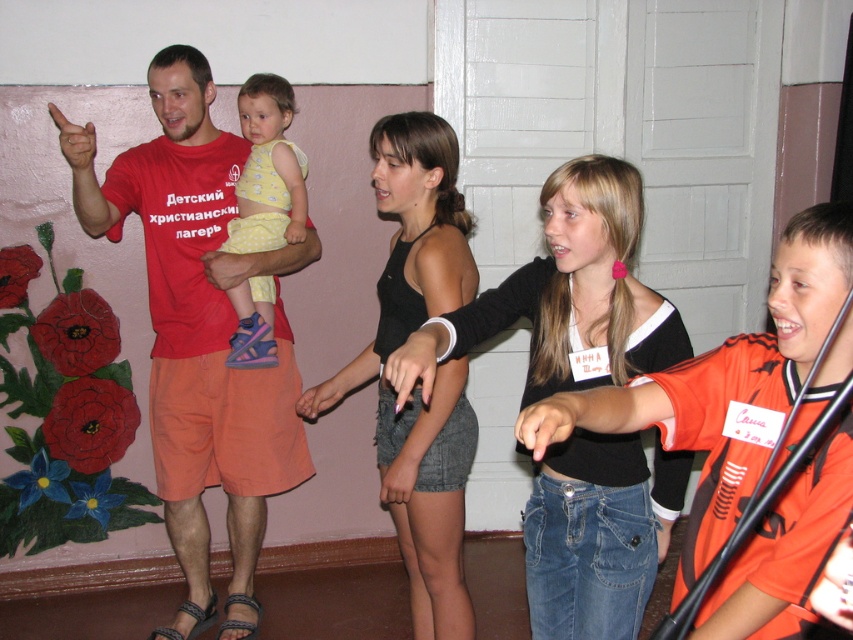
You are a fashion designer observing the image and need to arrange the denim shorts at center and black cotton tank top at center for a photoshoot. Which clothing item should be placed to the right to match the original image?

The denim shorts at center should be placed to the right of the black cotton tank top at center to match the original image.

You are a fashion designer observing the image. You need to determine which item is shorter in height between the denim shorts at center and the black cotton tank top at center. Which one is it?

The denim shorts at center has a lesser height compared to the black cotton tank top at center, so the denim shorts at center is shorter in height.